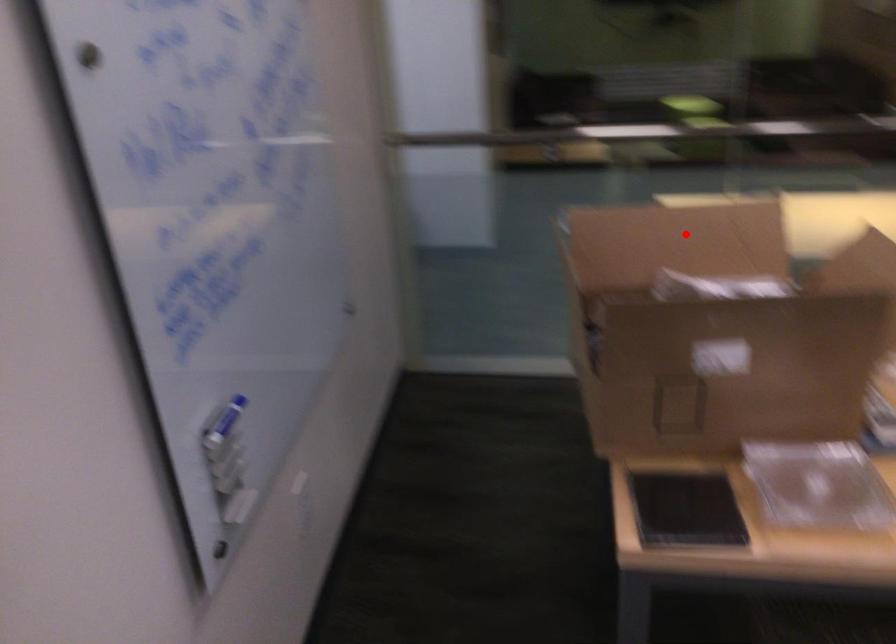
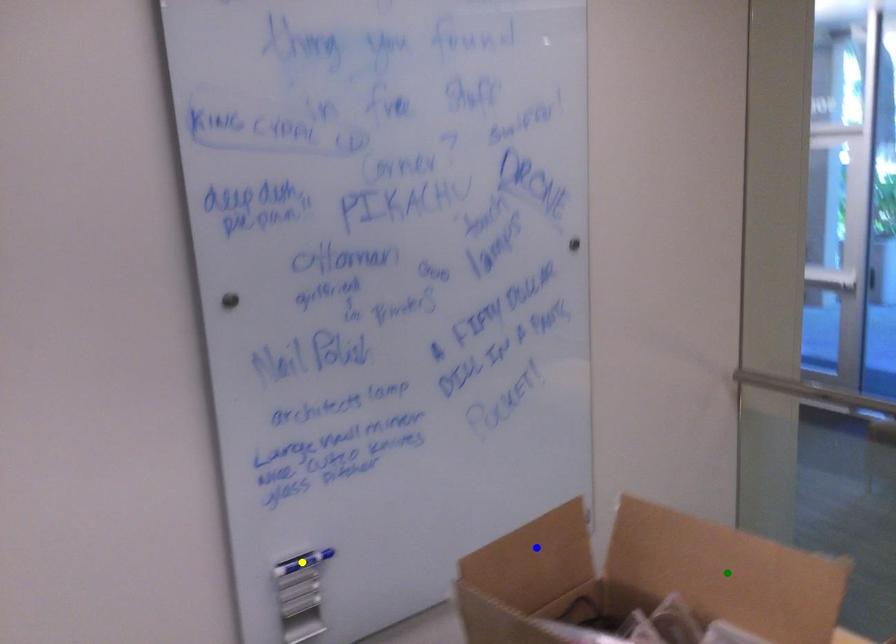
Question: I am providing you with two images of the same scene from different viewpoints. A red point is marked on the first image. You are given multiple points on the second image. In image 2, which mark is for the same physical point as the one in image 1?

Choices:
 (A) yellow point
 (B) green point
 (C) blue point

Answer: (B)